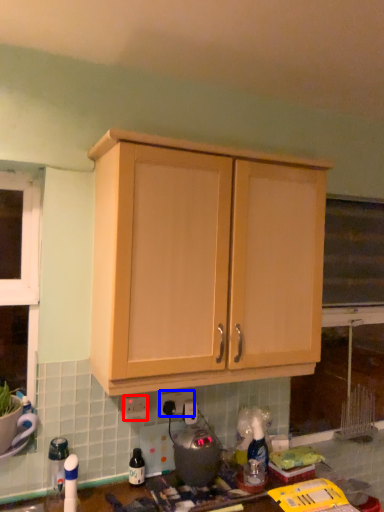
Question: Which of the following is the closest to the observer, electric outlet (highlighted by a red box) or electric outlet (highlighted by a blue box)?

Choices:
 (A) electric outlet
 (B) electric outlet

Answer: (A)